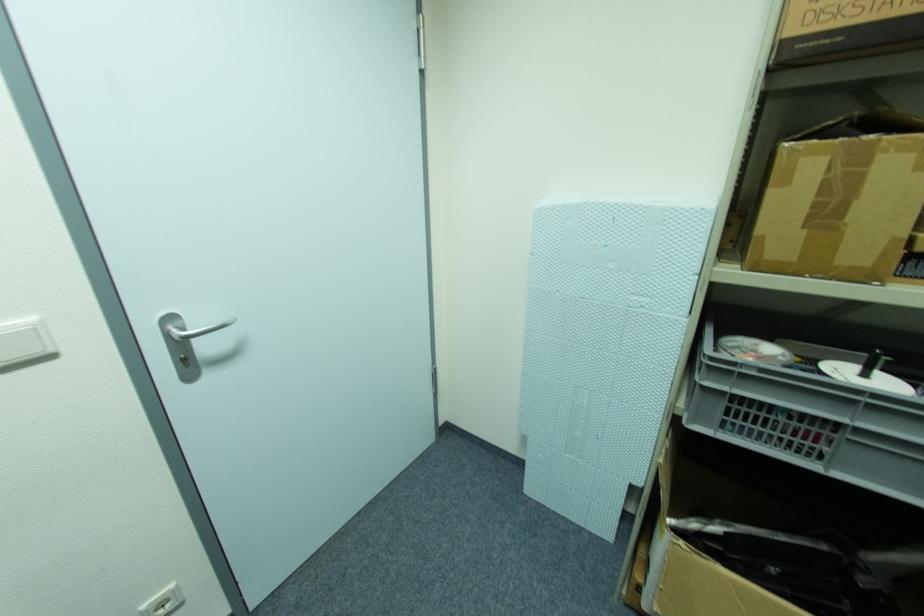
This screenshot has width=924, height=616. In order to click on styrofoam panel in this screenshot , I will do `click(602, 344)`.